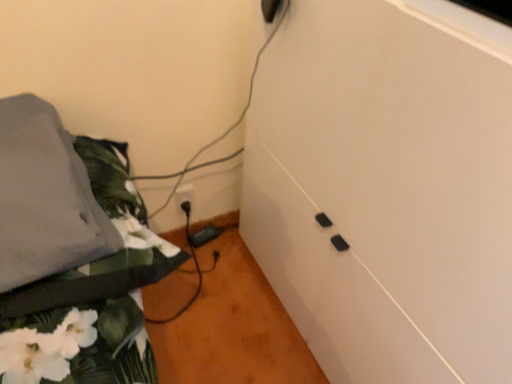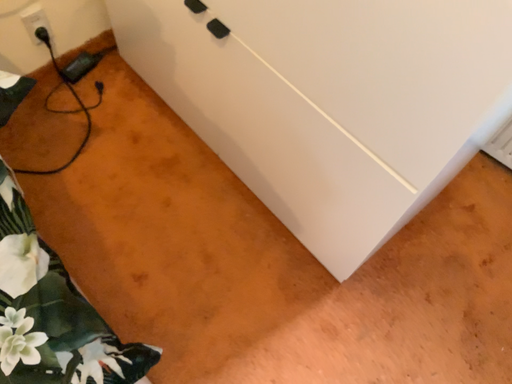
Question: How did the camera likely rotate when shooting the video?

Choices:
 (A) rotated right
 (B) rotated left

Answer: (A)